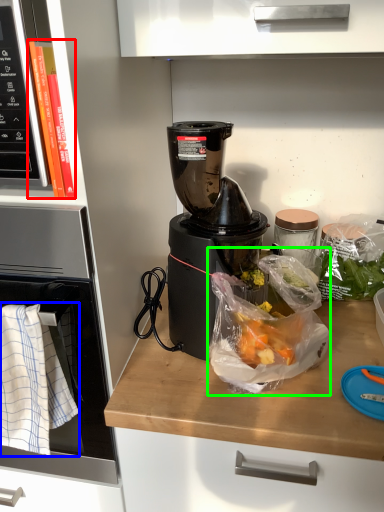
Question: Considering the real-world distances, which object is closest to book (highlighted by a red box)? cloth (highlighted by a blue box) or plastic bag (highlighted by a green box).

Choices:
 (A) cloth
 (B) plastic bag

Answer: (A)